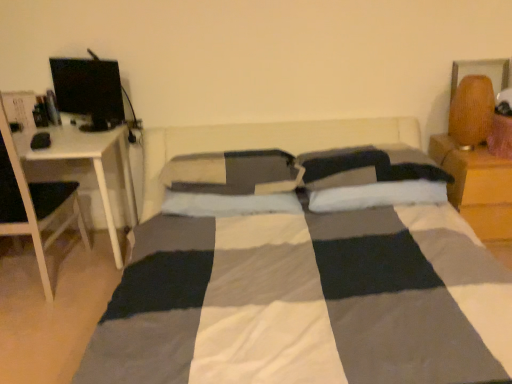
What is the approximate height of matte black monitor at upper left?

The height of matte black monitor at upper left is 15.05 inches.

You are a GUI agent. You are given a task and a screenshot of the screen. Output one action in this format:
    pyautogui.click(x=<x>, y=<y>)
    Task: Click on the white soft pillow at center, which is the 1th pillow from right to left
    The image size is (512, 384).
    Given the screenshot: What is the action you would take?
    pyautogui.click(x=374, y=195)

What is the approximate height of white plastic computer desk at left?

white plastic computer desk at left is 28.45 inches tall.

Find the location of a particular element. This screenshot has width=512, height=384. white plastic computer desk at left is located at coordinates (92, 125).

Describe the element at coordinates (477, 187) in the screenshot. Image resolution: width=512 pixels, height=384 pixels. I see `wooden nightstand at right` at that location.

Measure the distance between point (474, 83) and camera.

The distance of point (474, 83) from camera is 2.21 meters.

I want to click on white soft pillow at center, which is counted as the 2th pillow, starting from the left, so click(x=228, y=203).

You are a GUI agent. You are given a task and a screenshot of the screen. Output one action in this format:
    pyautogui.click(x=<x>, y=<y>)
    Task: Click on the matte black monitor at upper left
    This screenshot has width=512, height=384.
    Given the screenshot: What is the action you would take?
    pyautogui.click(x=89, y=91)

How far apart are white plastic computer desk at left and wooden nightstand at right?

white plastic computer desk at left is 1.94 meters away from wooden nightstand at right.

Consider the image. Could you tell me if white plastic computer desk at left is facing wooden nightstand at right?

No, white plastic computer desk at left is not aimed at wooden nightstand at right.

From a real-world perspective, is white plastic computer desk at left positioned above or below wooden nightstand at right?

In terms of real-world spatial position, white plastic computer desk at left is above wooden nightstand at right.

Is white plastic computer desk at left smaller than wooden nightstand at right?

No.

Can you confirm if soft gray pillow at center, which ranks as the first pillow in left-to-right order, is taller than matte black monitor at upper left?

No.

Identify the location of the 1st pillow to the right of the matte black monitor at upper left, starting your count from the anchor. (234, 172).

Is point (281, 175) closer or farther from the camera than point (106, 92)?

Clearly, point (281, 175) is closer to the camera than point (106, 92).

Which object is closer to the camera, soft gray pillow at center, which ranks as the first pillow in left-to-right order, or matte black monitor at upper left?

soft gray pillow at center, which ranks as the first pillow in left-to-right order, is closer to the camera.

Could you tell me if matte black monitor at upper left is turned towards white plastic computer desk at left?

No, matte black monitor at upper left does not turn towards white plastic computer desk at left.

From the image's perspective, is matte black monitor at upper left above or below white plastic computer desk at left?

Clearly, from the image's perspective, matte black monitor at upper left is above white plastic computer desk at left.

Between matte black monitor at upper left and white plastic computer desk at left, which one has less height?

matte black monitor at upper left is shorter.

Does matte black monitor at upper left have a larger size compared to wooden nightstand at right?

Incorrect, matte black monitor at upper left is not larger than wooden nightstand at right.

In terms of width, does matte black monitor at upper left look wider or thinner when compared to wooden nightstand at right?

Clearly, matte black monitor at upper left has less width compared to wooden nightstand at right.

Based on the photo, from a real-world perspective, which object stands above the other?

matte black monitor at upper left.

Identify the location of nightstand that is below the matte black monitor at upper left (from the image's perspective). (477, 187).

From a real-world perspective, does white plastic computer desk at left stand above braided wood table lamp at upper right?

Actually, white plastic computer desk at left is physically below braided wood table lamp at upper right in the real world.

In the scene shown: Can you confirm if white plastic computer desk at left is smaller than braided wood table lamp at upper right?

No.

Does white plastic computer desk at left have a greater height compared to braided wood table lamp at upper right?

Yes, white plastic computer desk at left is taller than braided wood table lamp at upper right.

In terms of width, does white plastic computer desk at left look wider or thinner when compared to braided wood table lamp at upper right?

white plastic computer desk at left is wider than braided wood table lamp at upper right.

From a real-world perspective, is matte black monitor at upper left over white soft pillow at center, which is counted as the 2th pillow, starting from the left?

Correct, in the physical world, matte black monitor at upper left is higher than white soft pillow at center, which is counted as the 2th pillow, starting from the left.

In the scene shown: How far apart are matte black monitor at upper left and white soft pillow at center, which is counted as the 2th pillow, starting from the left?

matte black monitor at upper left and white soft pillow at center, which is counted as the 2th pillow, starting from the left, are 29.57 inches apart from each other.

Which of these two, matte black monitor at upper left or white soft pillow at center, which is counted as the 2th pillow, starting from the left, is bigger?

white soft pillow at center, which is counted as the 2th pillow, starting from the left.

Is matte black monitor at upper left positioned beyond the bounds of white soft pillow at center, which is counted as the 2th pillow, starting from the left?

Yes.

Is braided wood table lamp at upper right wider than soft gray pillow at center, which ranks as the first pillow in left-to-right order?

Incorrect, the width of braided wood table lamp at upper right does not surpass that of soft gray pillow at center, which ranks as the first pillow in left-to-right order.

From the image's perspective, between braided wood table lamp at upper right and soft gray pillow at center, which ranks as the first pillow in left-to-right order, which one is located above?

braided wood table lamp at upper right is shown above in the image.

Considering the sizes of braided wood table lamp at upper right and soft gray pillow at center, which ranks as the first pillow in left-to-right order, in the image, is braided wood table lamp at upper right taller or shorter than soft gray pillow at center, which ranks as the first pillow in left-to-right order,?

braided wood table lamp at upper right is taller than soft gray pillow at center, which ranks as the first pillow in left-to-right order.

Which object is closer to the camera taking this photo, braided wood table lamp at upper right or soft gray pillow at center, the third pillow positioned from the right?

soft gray pillow at center, the third pillow positioned from the right, is closer to the camera.

The height and width of the screenshot is (384, 512). Find the location of `computer desk below the wooden nightstand at right (from the image's perspective)`. computer desk below the wooden nightstand at right (from the image's perspective) is located at coordinates (92, 125).

Starting from the matte black monitor at upper left, which pillow is the 2nd one in front? Please provide its 2D coordinates.

[(234, 172)]

Based on their spatial positions, is white soft pillow at center, which is the 1th pillow from right to left, or soft gray pillow at center, which ranks as the first pillow in left-to-right order, closer to matte black monitor at upper left?

Among the two, soft gray pillow at center, which ranks as the first pillow in left-to-right order, is located nearer to matte black monitor at upper left.

Considering their positions, is wooden nightstand at right positioned further to white soft pillow at center, the second pillow in the right-to-left sequence, than braided wood table lamp at upper right?

braided wood table lamp at upper right.

Based on the photo, considering their positions, is white soft pillow at center, the third pillow when ordered from left to right, positioned further to white soft pillow at center, the second pillow in the right-to-left sequence, than wooden nightstand at right?

wooden nightstand at right.

From the image, which object appears to be farther from soft gray pillow at center, which ranks as the first pillow in left-to-right order, braided wood table lamp at upper right or matte black monitor at upper left?

braided wood table lamp at upper right is further to soft gray pillow at center, which ranks as the first pillow in left-to-right order.

Looking at the image, which one is located further to soft gray pillow at center, the third pillow positioned from the right, wooden nightstand at right or braided wood table lamp at upper right?

braided wood table lamp at upper right.

Looking at the image, which one is located further to white soft pillow at center, the third pillow when ordered from left to right, white soft pillow at center, which is counted as the 2th pillow, starting from the left, or braided wood table lamp at upper right?

Among the two, braided wood table lamp at upper right is located further to white soft pillow at center, the third pillow when ordered from left to right.

Estimate the real-world distances between objects in this image. Which object is closer to wooden nightstand at right, white soft pillow at center, the third pillow when ordered from left to right, or matte black monitor at upper left?

white soft pillow at center, the third pillow when ordered from left to right, is closer to wooden nightstand at right.

Looking at the image, which one is located further to white plastic computer desk at left, braided wood table lamp at upper right or white soft pillow at center, the third pillow when ordered from left to right?

Based on the image, braided wood table lamp at upper right appears to be further to white plastic computer desk at left.

The height and width of the screenshot is (384, 512). What are the coordinates of `computer monitor between white plastic computer desk at left and soft gray pillow at center, the third pillow positioned from the right, from left to right` in the screenshot? It's located at (89, 91).

Where is `computer monitor located between white plastic computer desk at left and braided wood table lamp at upper right in the left-right direction`? The width and height of the screenshot is (512, 384). computer monitor located between white plastic computer desk at left and braided wood table lamp at upper right in the left-right direction is located at coordinates (89, 91).

Identify the location of table lamp between white plastic computer desk at left and wooden nightstand at right. (471, 111).

Find the location of a particular element. The image size is (512, 384). table lamp between matte black monitor at upper left and wooden nightstand at right from left to right is located at coordinates (471, 111).